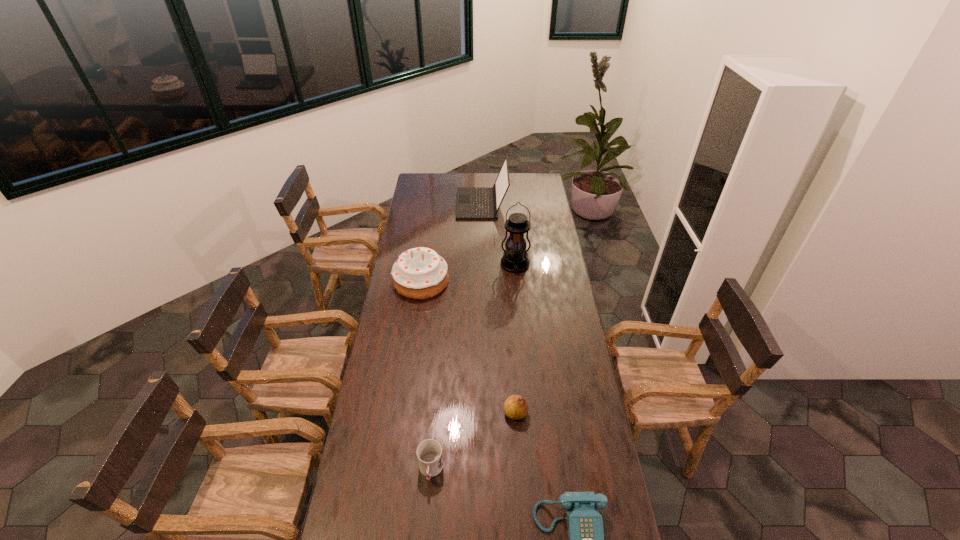
Find the location of a particular element. object that ranks as the fourth closest to the pear is located at coordinates (515, 259).